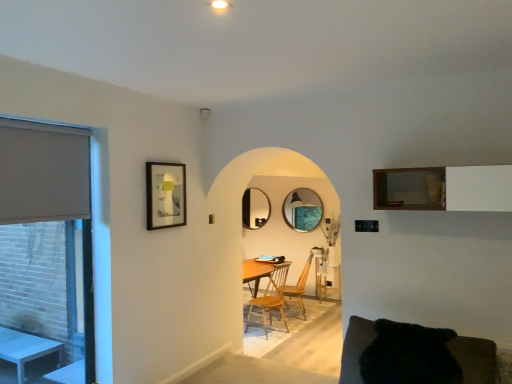
Question: Which direction should I rotate to look at matte black mirror at center, the second mirror when ordered from right to left?

Choices:
 (A) left
 (B) right

Answer: (B)

Question: Can you confirm if matte gray roller blind at left is taller than wooden chair at center, positioned as the second chair in back-to-front order?

Choices:
 (A) no
 (B) yes

Answer: (A)

Question: Does matte gray roller blind at left have a greater width compared to wooden chair at center, positioned as the second chair in back-to-front order?

Choices:
 (A) no
 (B) yes

Answer: (A)

Question: Can you confirm if matte gray roller blind at left is smaller than wooden chair at center, positioned as the second chair in back-to-front order?

Choices:
 (A) no
 (B) yes

Answer: (B)

Question: From a real-world perspective, is matte gray roller blind at left over wooden chair at center, positioned as the second chair in back-to-front order?

Choices:
 (A) yes
 (B) no

Answer: (A)

Question: Could you tell me if matte gray roller blind at left is turned towards wooden chair at center, positioned as the second chair in back-to-front order?

Choices:
 (A) yes
 (B) no

Answer: (B)

Question: From a real-world perspective, is matte gray roller blind at left positioned under wooden chair at center, positioned as the second chair in back-to-front order, based on gravity?

Choices:
 (A) yes
 (B) no

Answer: (B)

Question: Does beige fabric window at left have a lesser width compared to wooden chair at center, positioned as the second chair in back-to-front order?

Choices:
 (A) no
 (B) yes

Answer: (B)

Question: Could you tell me if beige fabric window at left is facing wooden chair at center, positioned as the second chair in back-to-front order?

Choices:
 (A) yes
 (B) no

Answer: (B)

Question: Are beige fabric window at left and wooden chair at center, placed as the first chair when sorted from front to back, located far from each other?

Choices:
 (A) no
 (B) yes

Answer: (B)

Question: Would you say wooden chair at center, positioned as the second chair in back-to-front order, is part of beige fabric window at left's contents?

Choices:
 (A) no
 (B) yes

Answer: (A)

Question: Is beige fabric window at left wider than wooden chair at center, placed as the first chair when sorted from front to back?

Choices:
 (A) no
 (B) yes

Answer: (A)

Question: From a real-world perspective, is beige fabric window at left physically below wooden chair at center, placed as the first chair when sorted from front to back?

Choices:
 (A) no
 (B) yes

Answer: (A)

Question: Does black fuzzy couch at lower right have a lesser height compared to matte glass mirror at center, placed as the 2th mirror when sorted from back to front?

Choices:
 (A) yes
 (B) no

Answer: (A)